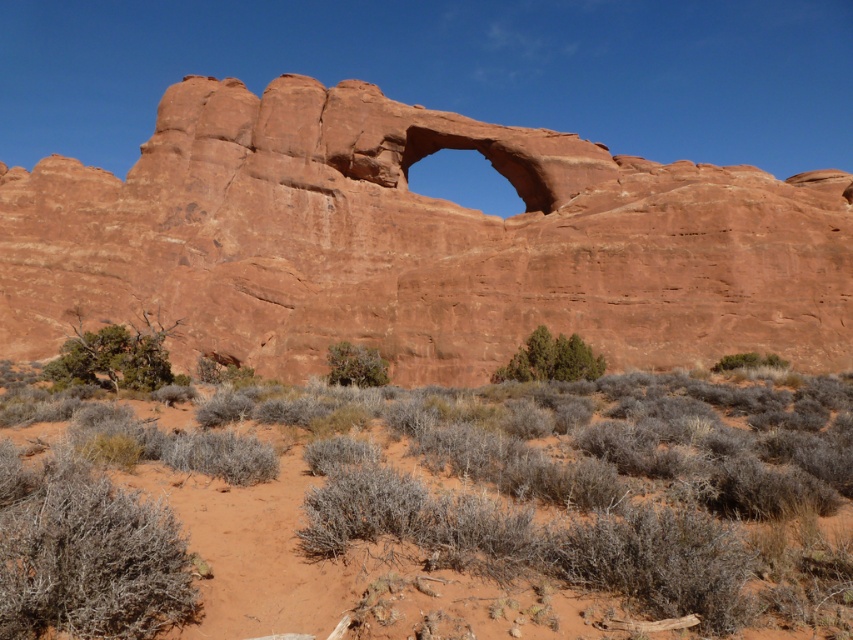
You are a hiker standing at the base of the sandstone arch and see the green leafy shrub at center and the green shrub at center. Which one is positioned higher up relative to the ground?

The green leafy shrub at center is located above the green shrub at center, so it is positioned higher up relative to the ground.